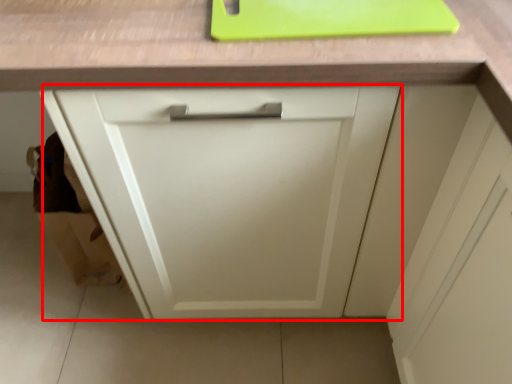
Question: From the image's perspective, what is the correct spatial positioning of cabinetry (annotated by the red box) in reference to cutting board?

Choices:
 (A) below
 (B) above

Answer: (A)